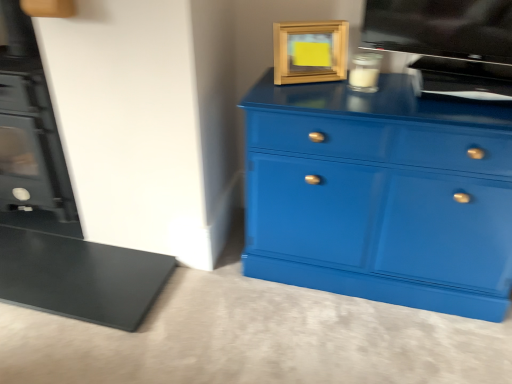
At what (x,y) coordinates should I click in order to perform the action: click on free space on the front side of clear glass candle at upper center, placed as the first appliance when sorted from left to right. Please return your answer as a coordinate pair (x, y). This screenshot has width=512, height=384. Looking at the image, I should click on (370, 103).